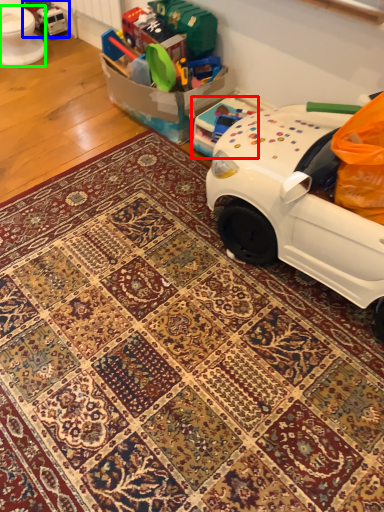
Question: Which object is the closest to the toy (highlighted by a red box)? Choose among these: toy (highlighted by a blue box) or toilet bowl (highlighted by a green box).

Choices:
 (A) toy
 (B) toilet bowl

Answer: (B)